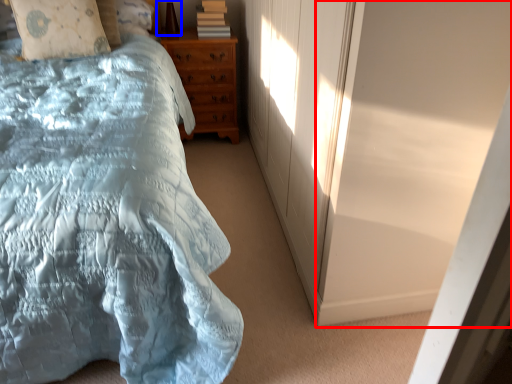
Question: Among these objects, which one is nearest to the camera, screen door (highlighted by a red box) or table lamp (highlighted by a blue box)?

Choices:
 (A) screen door
 (B) table lamp

Answer: (A)